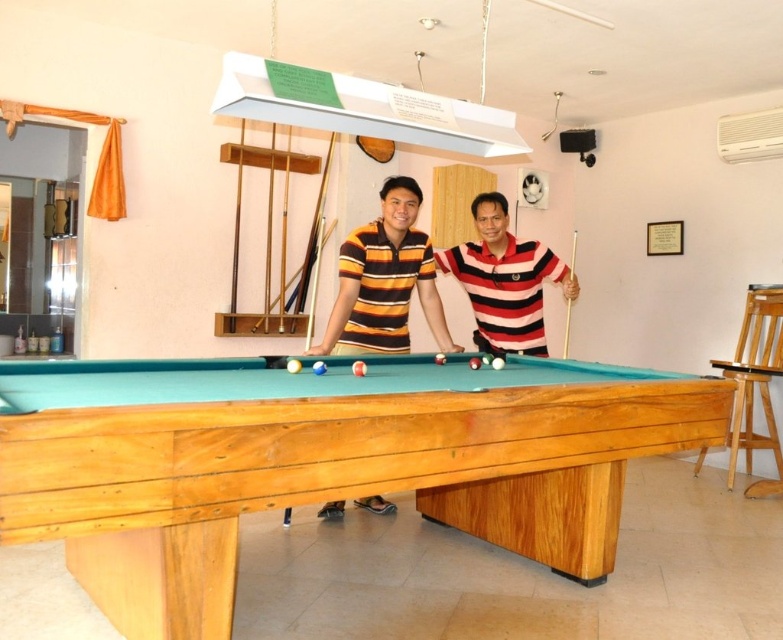
Question: Can you confirm if striped jersey at center is positioned below striped polo shirt at center?

Choices:
 (A) no
 (B) yes

Answer: (A)

Question: Among these objects, which one is nearest to the camera?

Choices:
 (A) striped polo shirt at center
 (B) striped jersey at center
 (C) natural wood billiard table at center

Answer: (C)

Question: Is the position of natural wood billiard table at center less distant than that of striped jersey at center?

Choices:
 (A) no
 (B) yes

Answer: (B)

Question: Among these objects, which one is farthest from the camera?

Choices:
 (A) natural wood billiard table at center
 (B) striped polo shirt at center

Answer: (B)

Question: Which point is farther to the camera?

Choices:
 (A) click(590, 388)
 (B) click(466, 248)
 (C) click(388, 310)

Answer: (B)

Question: From the image, what is the correct spatial relationship of natural wood billiard table at center in relation to striped polo shirt at center?

Choices:
 (A) left
 (B) right

Answer: (A)